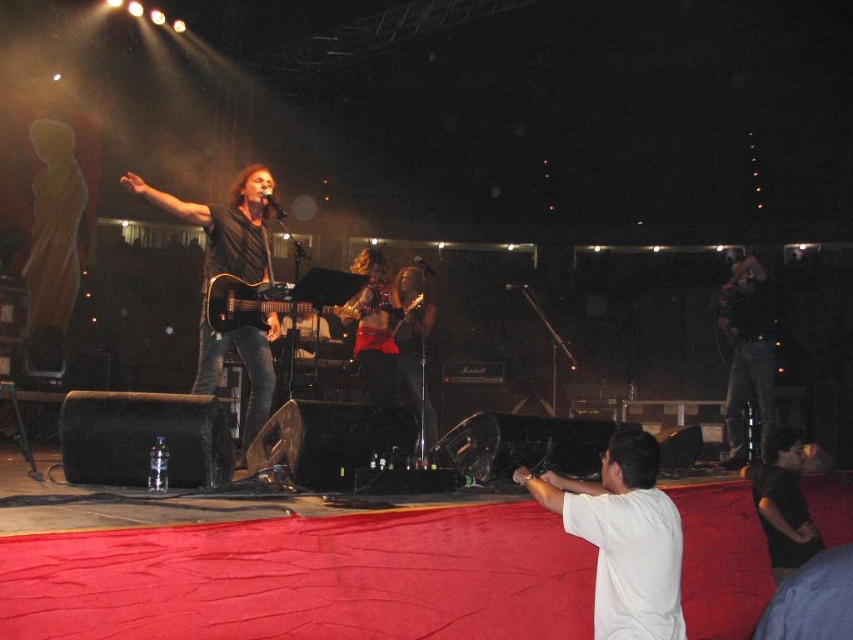
Between point (646, 456) and point (791, 449), which one is positioned in front?

Point (646, 456) is more forward.

Identify the location of white cotton shirt at center. The height and width of the screenshot is (640, 853). (624, 538).

Does white cotton shirt at center have a larger size compared to black matte guitar at center?

Indeed, white cotton shirt at center has a larger size compared to black matte guitar at center.

Is white cotton shirt at center closer to the viewer compared to black matte guitar at center?

Yes, white cotton shirt at center is in front of black matte guitar at center.

Who is more forward, [567,502] or [202,384]?

Point [567,502]

Locate an element on the screen. This screenshot has width=853, height=640. white cotton shirt at center is located at coordinates 624,538.

Does black matte guitar at center have a larger size compared to black matte shirt at lower right?

Correct, black matte guitar at center is larger in size than black matte shirt at lower right.

Consider the image. Does black matte guitar at center have a greater height compared to black matte shirt at lower right?

Yes.

The image size is (853, 640). What do you see at coordinates (224, 224) in the screenshot?
I see `black matte guitar at center` at bounding box center [224, 224].

Image resolution: width=853 pixels, height=640 pixels. Find the location of `black matte guitar at center`. black matte guitar at center is located at coordinates (224, 224).